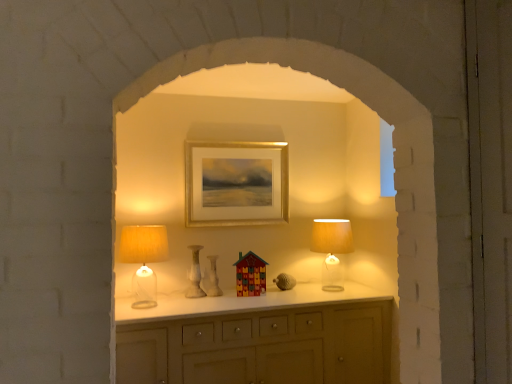
Question: Considering the positions of white marble vase at center, the second vase viewed from the right, and matte yellow fabric lampshade at left, which ranks as the second table lamp in right-to-left order, in the image, is white marble vase at center, the second vase viewed from the right, taller or shorter than matte yellow fabric lampshade at left, which ranks as the second table lamp in right-to-left order,?

Choices:
 (A) short
 (B) tall

Answer: (A)

Question: Is white marble vase at center, the second vase viewed from the right, bigger or smaller than matte yellow fabric lampshade at left, which is the second table lamp from back to front?

Choices:
 (A) small
 (B) big

Answer: (A)

Question: Based on their relative distances, which object is nearer to the translucent glass table lamp at right, acting as the first table lamp starting from the back?

Choices:
 (A) matte yellow fabric lampshade at left, which is the second table lamp from back to front
 (B) white marble vase at center, which is the 1th vase from left to right
 (C) gold metallic picture frame at center
 (D) white glossy vase at center, the first vase when ordered from right to left
 (E) wooden multicolored house at center

Answer: (E)

Question: Estimate the real-world distances between objects in this image. Which object is closer to the wooden multicolored house at center?

Choices:
 (A) white glossy vase at center, acting as the second vase starting from the left
 (B) matte yellow fabric lampshade at left, the first table lamp when ordered from front to back
 (C) white marble vase at center, the second vase viewed from the right
 (D) translucent glass table lamp at right, the 1th table lamp in the right-to-left sequence
 (E) gold metallic picture frame at center

Answer: (A)